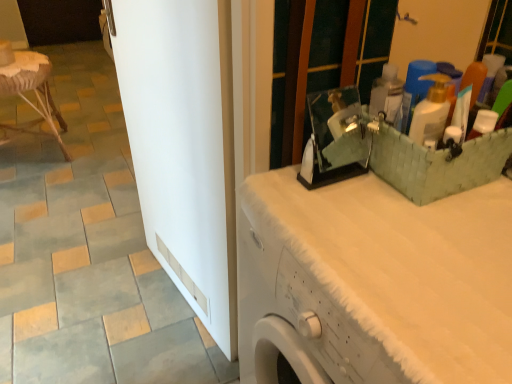
Question: Should I look upward or downward to see rattan stool at left?

Choices:
 (A) up
 (B) down

Answer: (A)

Question: From the image's perspective, would you say gray matte tile at lower left is shown under white glossy door at center?

Choices:
 (A) no
 (B) yes

Answer: (B)

Question: Considering the relative sizes of gray matte tile at lower left and white glossy door at center in the image provided, is gray matte tile at lower left taller than white glossy door at center?

Choices:
 (A) no
 (B) yes

Answer: (A)

Question: Does gray matte tile at lower left have a smaller size compared to white glossy door at center?

Choices:
 (A) yes
 (B) no

Answer: (A)

Question: From the image's perspective, is gray matte tile at lower left located above white glossy door at center?

Choices:
 (A) no
 (B) yes

Answer: (A)

Question: Is gray matte tile at lower left wider than white glossy door at center?

Choices:
 (A) no
 (B) yes

Answer: (B)

Question: Is gray matte tile at lower left with white glossy door at center?

Choices:
 (A) yes
 (B) no

Answer: (B)

Question: Is rattan stool at left in front of gray matte tile at lower left?

Choices:
 (A) no
 (B) yes

Answer: (A)

Question: Can you confirm if rattan stool at left is bigger than gray matte tile at lower left?

Choices:
 (A) no
 (B) yes

Answer: (B)

Question: Is rattan stool at left further to camera compared to gray matte tile at lower left?

Choices:
 (A) yes
 (B) no

Answer: (A)

Question: Is rattan stool at left wider than gray matte tile at lower left?

Choices:
 (A) yes
 (B) no

Answer: (A)

Question: Is there a large distance between rattan stool at left and gray matte tile at lower left?

Choices:
 (A) yes
 (B) no

Answer: (A)

Question: Is rattan stool at left outside gray matte tile at lower left?

Choices:
 (A) yes
 (B) no

Answer: (A)

Question: From the image's perspective, would you say gray matte tile at lower left is shown under white textured counter top at upper right?

Choices:
 (A) no
 (B) yes

Answer: (B)